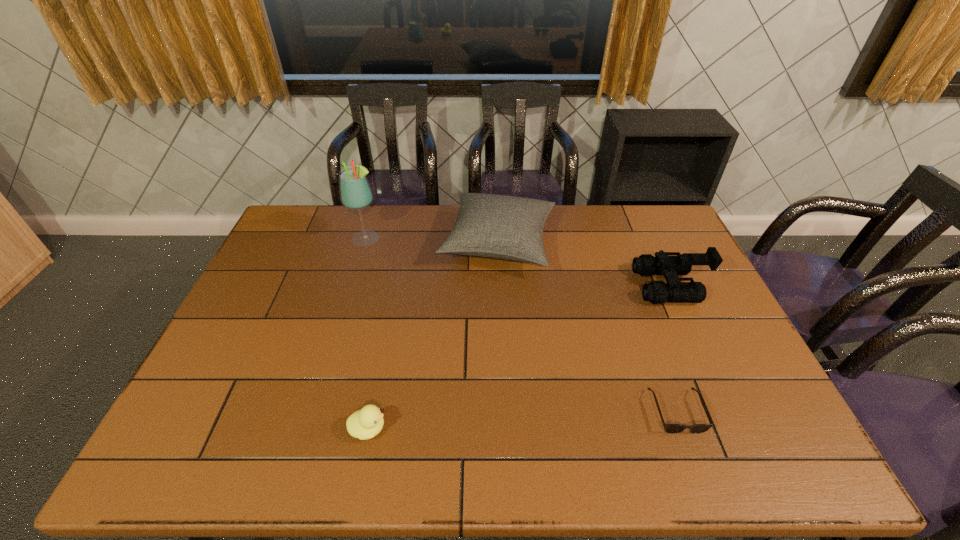
This screenshot has width=960, height=540. Find the location of `free space between the third object from left to right and the binoculars`. free space between the third object from left to right and the binoculars is located at coordinates (585, 265).

At what (x,y) coordinates should I click in order to perform the action: click on blank region between the leftmost object and the second object from left to right. Please return your answer as a coordinate pair (x, y). The image size is (960, 540). Looking at the image, I should click on [x=368, y=334].

Where is `vacant region between the tallest object and the binoculars`? vacant region between the tallest object and the binoculars is located at coordinates (519, 262).

Identify which object is the second closest to the cushion. Please provide its 2D coordinates. Your answer should be formatted as a tuple, i.e. [(x, y)], where the tuple contains the x and y coordinates of a point satisfying the conditions above.

[(674, 291)]

Locate an element on the screen. The width and height of the screenshot is (960, 540). the closest object to the tallest object is located at coordinates (504, 227).

This screenshot has height=540, width=960. Find the location of `free space that satisfies the following two spatial constraints: 1. on the front lenses of the binoculars; 2. at the front lenses of the sunglasses`. free space that satisfies the following two spatial constraints: 1. on the front lenses of the binoculars; 2. at the front lenses of the sunglasses is located at coordinates (728, 411).

The width and height of the screenshot is (960, 540). Identify the location of free space that satisfies the following two spatial constraints: 1. on the front side of the cushion; 2. on the right side of the leftmost object. (366, 243).

Identify the location of blank space that satisfies the following two spatial constraints: 1. at the front lenses of the shortest object; 2. at the beak of the second object from left to right. The image size is (960, 540). (683, 428).